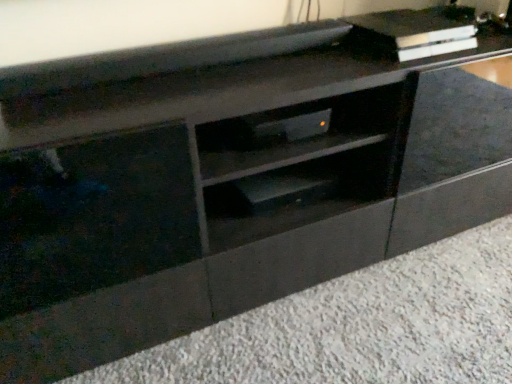
The width and height of the screenshot is (512, 384). Describe the element at coordinates (413, 33) in the screenshot. I see `metallic silver shelf at upper right` at that location.

Measure the distance between point (384, 17) and camera.

A distance of 1.58 meters exists between point (384, 17) and camera.

What are the coordinates of `metallic silver shelf at upper right` in the screenshot? It's located at (413, 33).

Locate an element on the screen. The width and height of the screenshot is (512, 384). metallic silver shelf at upper right is located at coordinates (413, 33).